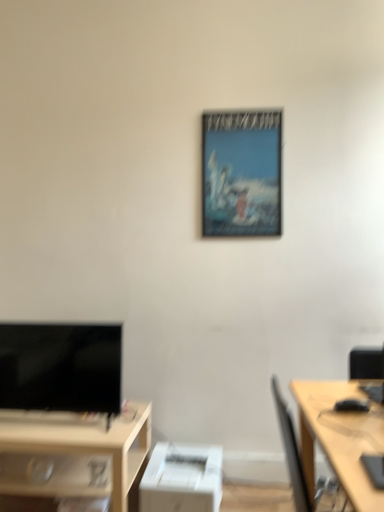
This screenshot has width=384, height=512. Find the location of `free location in front of black glossy tv at lower left`. free location in front of black glossy tv at lower left is located at coordinates (52, 431).